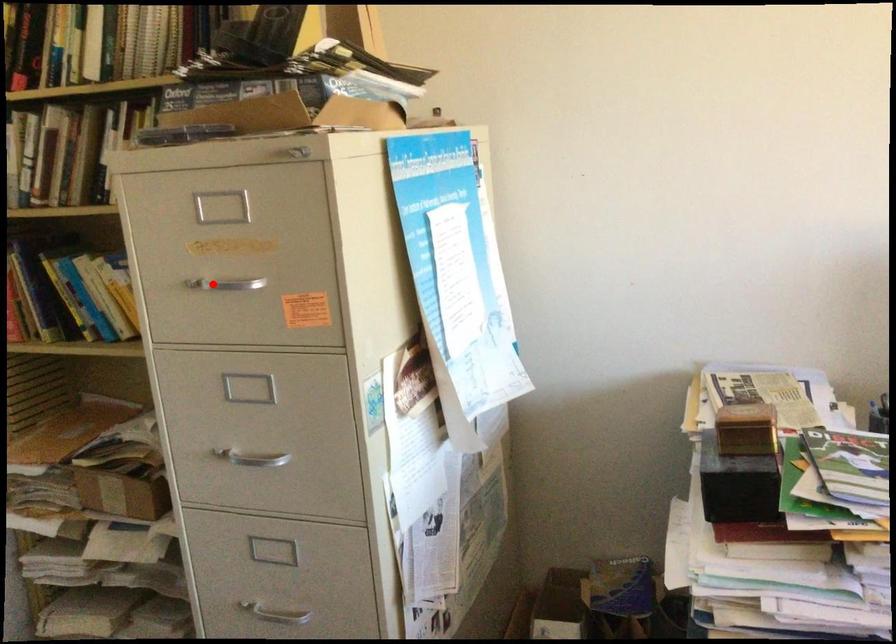
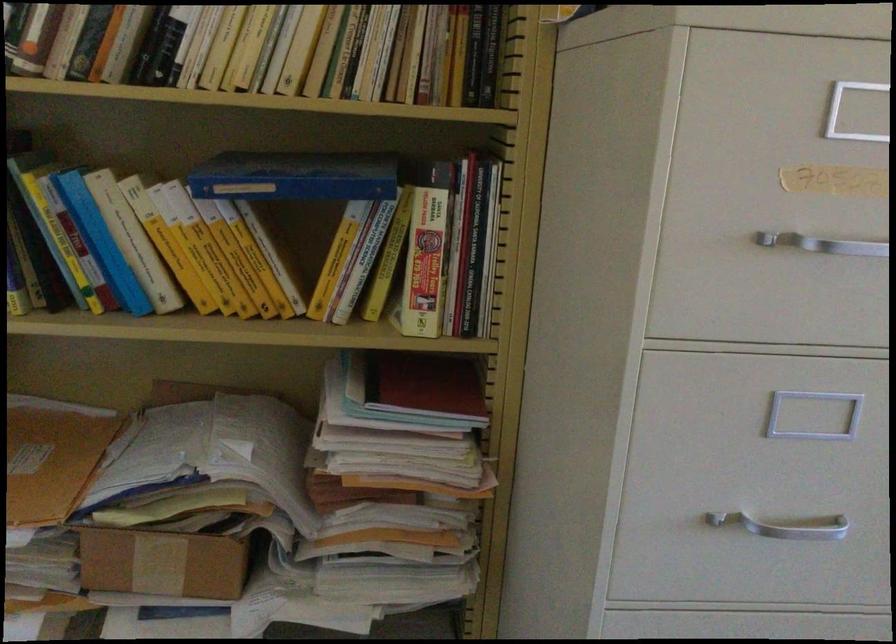
Question: I am providing you with two images of the same scene from different viewpoints. A red point is shown in image1. For the corresponding object point in image2, is it positioned nearer or farther from the camera?

Choices:
 (A) Nearer
 (B) Farther

Answer: (A)